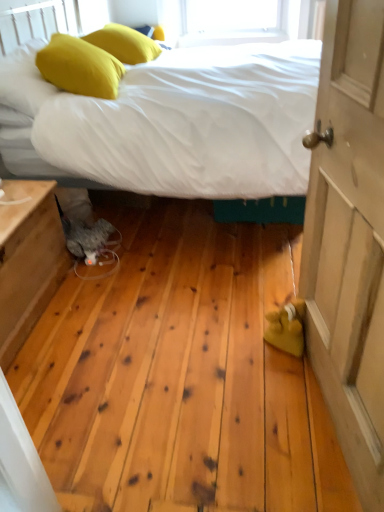
From the picture: Measure the distance between wooden door at right and camera.

wooden door at right is 34.39 inches away from camera.

Measure the distance between point [50,290] and camera.

1.90 meters.

Find the location of `yellow fabric pillow at upper left, marked as the first pillow in a top-to-bottom arrangement`. yellow fabric pillow at upper left, marked as the first pillow in a top-to-bottom arrangement is located at coordinates (124, 42).

Measure the distance between white fabric bed at center and camera.

A distance of 1.79 meters exists between white fabric bed at center and camera.

Identify the location of yellow fabric pillow at upper left, placed as the 2th pillow when sorted from top to bottom. The height and width of the screenshot is (512, 384). (80, 67).

Which of these two, yellow fabric pillow at upper left, which appears as the 2th pillow when viewed from the back, or wooden door at right, stands shorter?

yellow fabric pillow at upper left, which appears as the 2th pillow when viewed from the back, is shorter.

Considering the positions of objects yellow fabric pillow at upper left, which is the first pillow in front-to-back order, and wooden door at right in the image provided, who is more to the left, yellow fabric pillow at upper left, which is the first pillow in front-to-back order, or wooden door at right?

Positioned to the left is yellow fabric pillow at upper left, which is the first pillow in front-to-back order.

From the image's perspective, is yellow fabric pillow at upper left, which ranks as the 1th pillow in bottom-to-top order, positioned above or below wooden door at right?

From the image's perspective, yellow fabric pillow at upper left, which ranks as the 1th pillow in bottom-to-top order, appears above wooden door at right.

Which of these two, yellow fabric pillow at upper left, placed as the 2th pillow when sorted from top to bottom, or wooden door at right, is smaller?

yellow fabric pillow at upper left, placed as the 2th pillow when sorted from top to bottom.

Is wooden nightstand at lower left further to camera compared to yellow fabric pillow at upper left, marked as the first pillow in a top-to-bottom arrangement?

No.

From the image's perspective, starting from the wooden nightstand at lower left, which pillow is the 2nd one above? Please provide its 2D coordinates.

[(124, 42)]

How far apart are wooden nightstand at lower left and yellow fabric pillow at upper left, marked as the 2th pillow in a bottom-to-top arrangement?

wooden nightstand at lower left is 1.44 meters from yellow fabric pillow at upper left, marked as the 2th pillow in a bottom-to-top arrangement.

From a real-world perspective, relative to white fabric bed at center, is wooden door at right vertically above or below?

wooden door at right is situated higher than white fabric bed at center in the real world.

Is wooden door at right at the right side of white fabric bed at center?

Yes, wooden door at right is to the right of white fabric bed at center.

Consider the image. Considering the relative sizes of wooden door at right and white fabric bed at center in the image provided, is wooden door at right bigger than white fabric bed at center?

Actually, wooden door at right might be smaller than white fabric bed at center.

Is white fabric bed at center touching wooden door at right?

white fabric bed at center is not next to wooden door at right, and they're not touching.

From the image's perspective, is white fabric bed at center positioned above or below wooden door at right?

From the image's perspective, white fabric bed at center appears above wooden door at right.

Is white fabric bed at center inside the boundaries of wooden door at right, or outside?

white fabric bed at center is spatially situated outside wooden door at right.

Can you tell me how much white fabric bed at center and wooden door at right differ in facing direction?

They differ by 11.7 degrees in their facing directions.

Does point (223, 125) lie in front of point (64, 56)?

Yes, point (223, 125) is in front of point (64, 56).

Consider the image. Is white fabric bed at center positioned beyond the bounds of yellow fabric pillow at upper left, which appears as the 2th pillow when viewed from the back?

Absolutely, white fabric bed at center is external to yellow fabric pillow at upper left, which appears as the 2th pillow when viewed from the back.

From the image's perspective, is white fabric bed at center positioned above or below yellow fabric pillow at upper left, which is the first pillow in front-to-back order?

From the image's perspective, white fabric bed at center appears below yellow fabric pillow at upper left, which is the first pillow in front-to-back order.

Is white fabric bed at center thinner than yellow fabric pillow at upper left, which is the first pillow in front-to-back order?

No, white fabric bed at center is not thinner than yellow fabric pillow at upper left, which is the first pillow in front-to-back order.

From a real-world perspective, is wooden door at right positioned above or below wooden nightstand at lower left?

wooden door at right is situated higher than wooden nightstand at lower left in the real world.

Considering the sizes of wooden door at right and wooden nightstand at lower left in the image, is wooden door at right wider or thinner than wooden nightstand at lower left?

Clearly, wooden door at right has less width compared to wooden nightstand at lower left.

Is wooden door at right far from wooden nightstand at lower left?

Yes, wooden door at right is far from wooden nightstand at lower left.

Is wooden door at right further to the viewer compared to wooden nightstand at lower left?

No, it is not.

From a real-world perspective, is white fabric bed at center located beneath wooden nightstand at lower left?

No, from a real-world perspective, white fabric bed at center is not below wooden nightstand at lower left.

Where is `nightstand in front of the white fabric bed at center`? This screenshot has height=512, width=384. nightstand in front of the white fabric bed at center is located at coordinates (28, 261).

Can you confirm if white fabric bed at center is smaller than wooden nightstand at lower left?

No, white fabric bed at center is not smaller than wooden nightstand at lower left.

Who is shorter, white fabric bed at center or wooden nightstand at lower left?

With less height is wooden nightstand at lower left.

The height and width of the screenshot is (512, 384). I want to click on pillow that is the 1st object located above the wooden door at right (from the image's perspective), so click(80, 67).

You are a GUI agent. You are given a task and a screenshot of the screen. Output one action in this format:
    pyautogui.click(x=<x>, y=<y>)
    Task: Click on the 1st pillow directly above the wooden nightstand at lower left (from a real-world perspective)
    
    Given the screenshot: What is the action you would take?
    pyautogui.click(x=124, y=42)

Looking at the image, which one is located closer to white fabric bed at center, wooden door at right or yellow fabric pillow at upper left, the 1th pillow when ordered from back to front?

yellow fabric pillow at upper left, the 1th pillow when ordered from back to front, lies closer to white fabric bed at center than the other object.

Looking at the image, which one is located further to wooden door at right, yellow fabric pillow at upper left, which is the first pillow in front-to-back order, or wooden nightstand at lower left?

yellow fabric pillow at upper left, which is the first pillow in front-to-back order, is positioned further to the anchor wooden door at right.

From the image, which object appears to be farther from wooden door at right, white fabric bed at center or wooden nightstand at lower left?

The object further to wooden door at right is wooden nightstand at lower left.

Considering their positions, is wooden door at right positioned closer to yellow fabric pillow at upper left, placed as the 2th pillow when sorted from top to bottom, than yellow fabric pillow at upper left, marked as the first pillow in a top-to-bottom arrangement?

yellow fabric pillow at upper left, marked as the first pillow in a top-to-bottom arrangement, lies closer to yellow fabric pillow at upper left, placed as the 2th pillow when sorted from top to bottom, than the other object.

Looking at this image, looking at the image, which one is located closer to yellow fabric pillow at upper left, which ranks as the 1th pillow in bottom-to-top order, white fabric bed at center or yellow fabric pillow at upper left, the 1th pillow when ordered from back to front?

Based on the image, white fabric bed at center appears to be nearer to yellow fabric pillow at upper left, which ranks as the 1th pillow in bottom-to-top order.

Based on their spatial positions, is wooden door at right or white fabric bed at center closer to yellow fabric pillow at upper left, marked as the 2th pillow in a bottom-to-top arrangement?

Among the two, white fabric bed at center is located nearer to yellow fabric pillow at upper left, marked as the 2th pillow in a bottom-to-top arrangement.

Estimate the real-world distances between objects in this image. Which object is closer to wooden nightstand at lower left, yellow fabric pillow at upper left, marked as the first pillow in a top-to-bottom arrangement, or wooden door at right?

wooden door at right is closer to wooden nightstand at lower left.

Considering their positions, is yellow fabric pillow at upper left, which ranks as the 1th pillow in bottom-to-top order, positioned closer to wooden door at right than yellow fabric pillow at upper left, marked as the first pillow in a top-to-bottom arrangement?

yellow fabric pillow at upper left, which ranks as the 1th pillow in bottom-to-top order.

The image size is (384, 512). Find the location of `pillow between white fabric bed at center and yellow fabric pillow at upper left, marked as the first pillow in a top-to-bottom arrangement, along the z-axis`. pillow between white fabric bed at center and yellow fabric pillow at upper left, marked as the first pillow in a top-to-bottom arrangement, along the z-axis is located at coordinates (80, 67).

You are a GUI agent. You are given a task and a screenshot of the screen. Output one action in this format:
    pyautogui.click(x=<x>, y=<y>)
    Task: Click on the bed that lies between yellow fabric pillow at upper left, the 1th pillow when ordered from back to front, and wooden nightstand at lower left from top to bottom
    The image size is (384, 512).
    Given the screenshot: What is the action you would take?
    pyautogui.click(x=181, y=126)

Find the location of a particular element. The height and width of the screenshot is (512, 384). bed between wooden nightstand at lower left and wooden door at right from left to right is located at coordinates (181, 126).

What are the coordinates of `bed positioned between wooden door at right and yellow fabric pillow at upper left, which is counted as the second pillow, starting from the front, from near to far` in the screenshot? It's located at (181, 126).